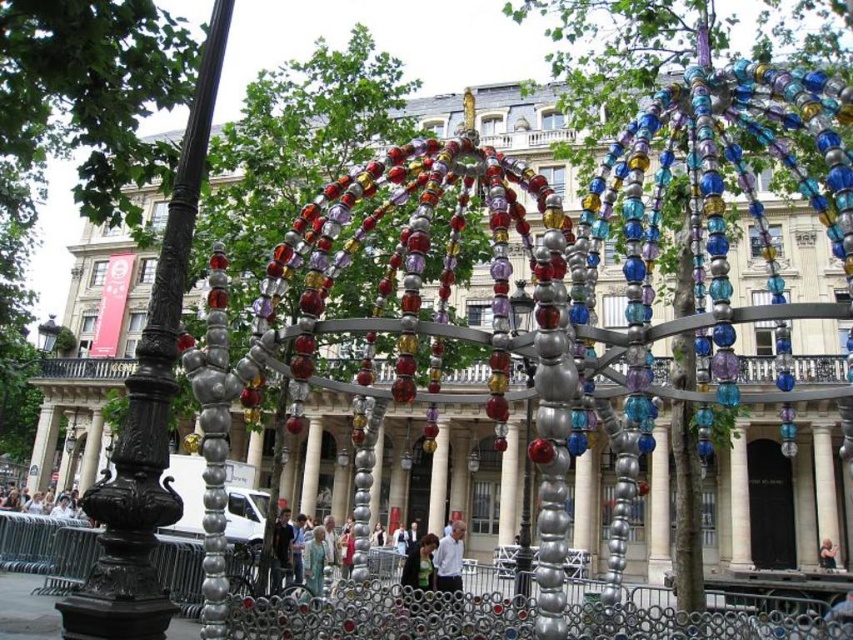
Question: Is multicolored glass beads at center positioned behind metallic silver fence at lower center?

Choices:
 (A) yes
 (B) no

Answer: (B)

Question: Is multicolored glass beads at center below light beige fabric coat at center?

Choices:
 (A) no
 (B) yes

Answer: (A)

Question: Is black metal pole at left in front of light brown leather jacket at center?

Choices:
 (A) yes
 (B) no

Answer: (A)

Question: Which object is closer to the camera taking this photo?

Choices:
 (A) light brown leather jacket at center
 (B) green fabric dress at center
 (C) metallic silver fence at lower center

Answer: (C)

Question: Which point is closer to the camera?

Choices:
 (A) white shirt at lower left
 (B) green fabric dress at center
 (C) metallic silver fence at lower center
 (D) multicolored glass beads at center

Answer: (D)

Question: Among these points, which one is nearest to the camera?

Choices:
 (A) (36, 512)
 (B) (410, 589)
 (C) (323, 536)

Answer: (B)